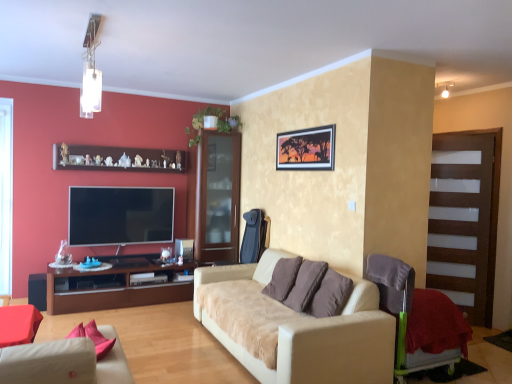
I want to click on vacant space underneath matte black picture frame at upper center (from a real-world perspective), so click(295, 252).